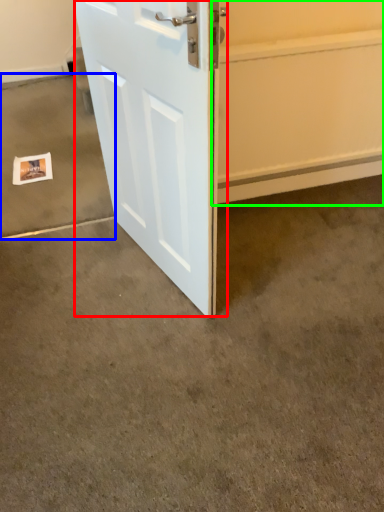
Question: Considering the real-world distances, which object is farthest from door (highlighted by a red box)? concrete (highlighted by a blue box) or garage door (highlighted by a green box)?

Choices:
 (A) concrete
 (B) garage door

Answer: (A)